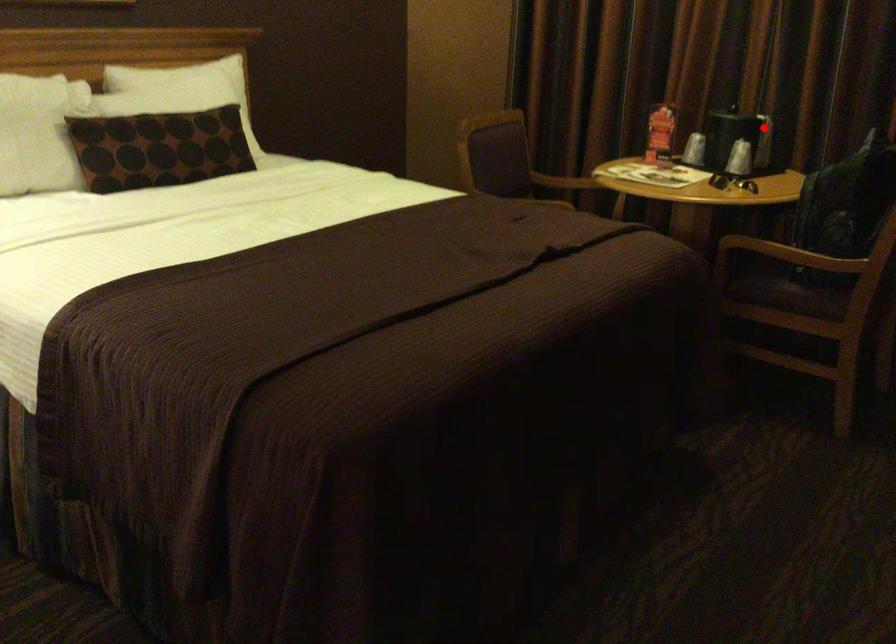
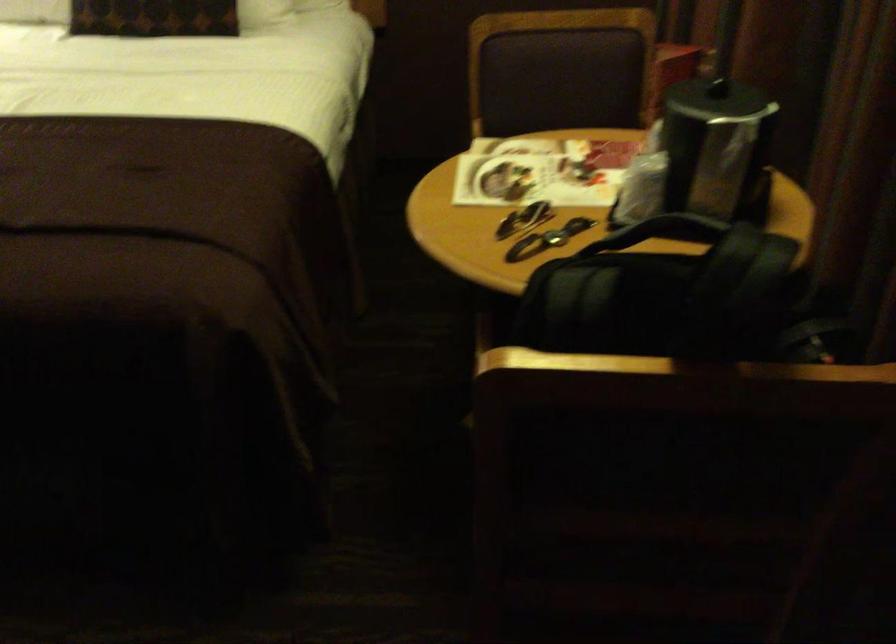
The point at the highlighted location is marked in the first image. Where is the corresponding point in the second image?

(717, 149)